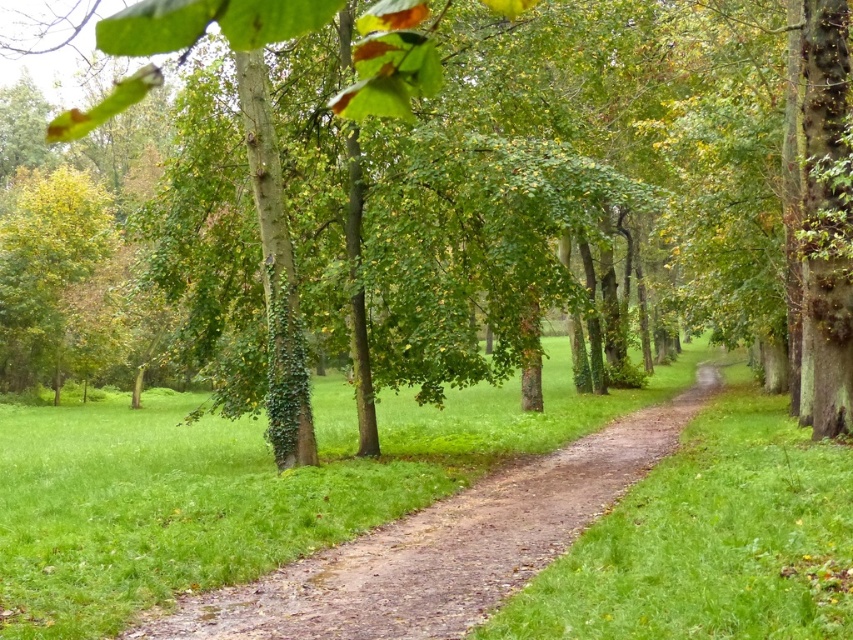
Question: In this image, where is green leafy tree at center located relative to brown dirt path at center?

Choices:
 (A) left
 (B) right

Answer: (A)

Question: Can you confirm if green leafy tree at center is positioned above brown dirt path at center?

Choices:
 (A) yes
 (B) no

Answer: (A)

Question: Which object is farther from the camera taking this photo?

Choices:
 (A) green leafy tree at center
 (B) brown dirt path at center

Answer: (A)

Question: Does green leafy tree at center appear on the right side of brown dirt path at center?

Choices:
 (A) no
 (B) yes

Answer: (A)